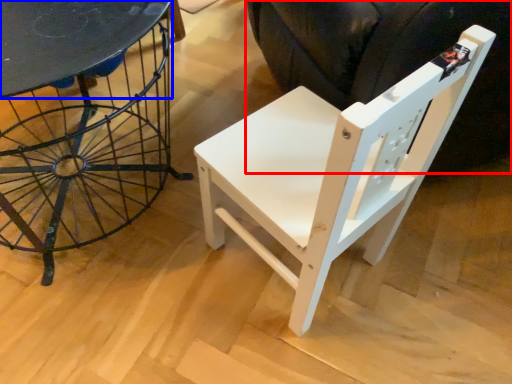
Question: Which of the following is the farthest to the observer, swivel chair (highlighted by a red box) or round table (highlighted by a blue box)?

Choices:
 (A) swivel chair
 (B) round table

Answer: (B)